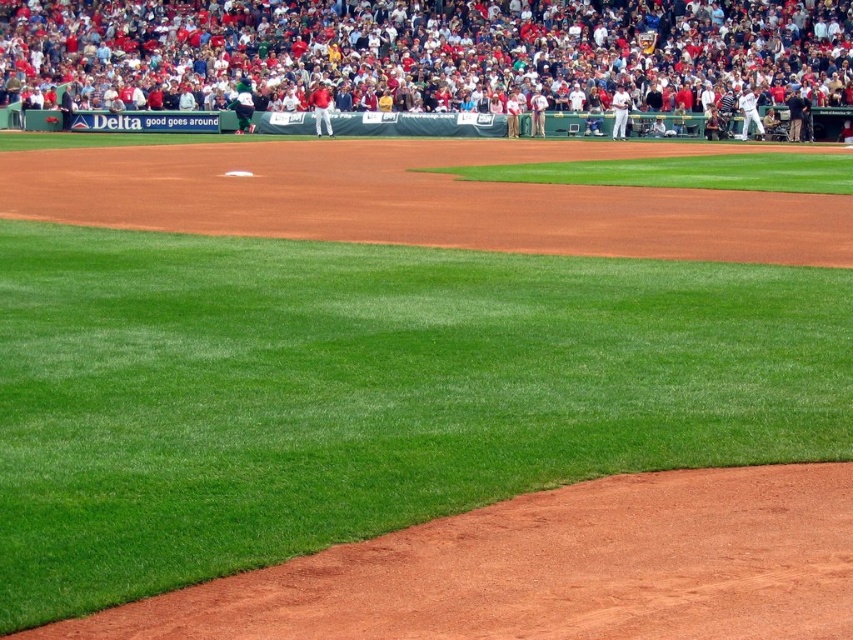
You are a photographer at the baseball stadium and want to capture both the white uniform at upper right and the light brown uniform at center in a single shot. Based on their positions, which uniform is higher in the frame?

The white uniform at upper right is located above the light brown uniform at center, so it is higher in the frame.

You are a photographer positioned at home plate and want to capture both the white uniform at upper right and the light brown uniform at center in your shot. Which player should you focus on first to ensure both are in clear view?

You should focus on the white uniform at upper right first since it is closer to the viewer than the light brown uniform at center, ensuring both will be in focus when starting with the closer subject.